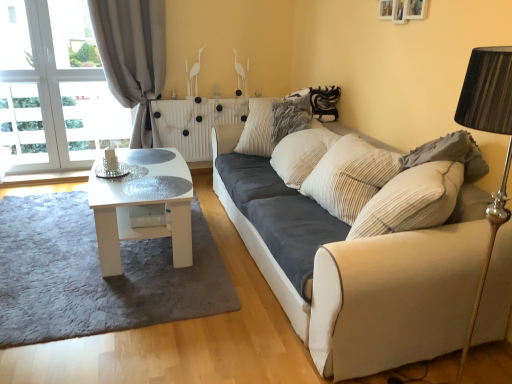
Image resolution: width=512 pixels, height=384 pixels. What do you see at coordinates (351, 260) in the screenshot?
I see `velvet beige couch at center` at bounding box center [351, 260].

Find the location of a particular element. striped fabric pillow at upper center, arranged as the second pillow when viewed from the front is located at coordinates [290, 116].

Describe the element at coordinates (157, 187) in the screenshot. I see `transparent glass table at center` at that location.

What do you see at coordinates (133, 57) in the screenshot?
I see `gray fabric curtain at left` at bounding box center [133, 57].

Locate an element on the screen. gray fabric curtain at left is located at coordinates (133, 57).

What do you see at coordinates (143, 206) in the screenshot? The image size is (512, 384). I see `white glossy coffee table at center` at bounding box center [143, 206].

What do you see at coordinates (96, 274) in the screenshot? I see `gray shaggy rug at lower left` at bounding box center [96, 274].

Describe the element at coordinates (450, 154) in the screenshot. I see `gray textured pillow at right, which is counted as the 1th pillow, starting from the front` at that location.

I want to click on velvet beige couch at center, so click(x=351, y=260).

Who is bigger, white glossy coffee table at center or gray shaggy rug at lower left?

white glossy coffee table at center is bigger.

Considering the sizes of objects white glossy coffee table at center and gray shaggy rug at lower left in the image provided, who is wider, white glossy coffee table at center or gray shaggy rug at lower left?

gray shaggy rug at lower left.

Does point (108, 235) come farther from viewer compared to point (15, 281)?

No, it is not.

Can you confirm if white glossy coffee table at center is taller than gray shaggy rug at lower left?

Yes, white glossy coffee table at center is taller than gray shaggy rug at lower left.

What's the angular difference between transparent glass table at center and white marble radiator at center's facing directions?

There is a 91.7-degree angle between the facing directions of transparent glass table at center and white marble radiator at center.

Is transparent glass table at center next to white marble radiator at center?

They are not placed beside each other.

Looking at this image, is transparent glass table at center wider or thinner than white marble radiator at center?

Clearly, transparent glass table at center has more width compared to white marble radiator at center.

From a real-world perspective, which is physically above, transparent glass table at center or white marble radiator at center?

transparent glass table at center is physically above.

Is striped fabric pillow at upper center, marked as the 1th pillow in a left-to-right arrangement, in contact with white marble radiator at center?

striped fabric pillow at upper center, marked as the 1th pillow in a left-to-right arrangement, and white marble radiator at center are clearly separated.

Which is behind, point (288, 107) or point (181, 113)?

The point (181, 113) is behind.

What are the coordinates of `radiator below the striped fabric pillow at upper center, marked as the 1th pillow in a left-to-right arrangement (from a real-world perspective)` in the screenshot? It's located at (195, 123).

From a real-world perspective, between striped fabric pillow at upper center, arranged as the second pillow when viewed from the front, and white marble radiator at center, who is vertically higher?

In real-world perspective, striped fabric pillow at upper center, arranged as the second pillow when viewed from the front, is above.

From a real-world perspective, is gray fabric curtain at left physically located above or below gray shaggy rug at lower left?

gray fabric curtain at left is situated higher than gray shaggy rug at lower left in the real world.

Measure the distance between gray fabric curtain at left and gray shaggy rug at lower left.

The distance of gray fabric curtain at left from gray shaggy rug at lower left is 5.02 feet.

Considering the positions of objects gray fabric curtain at left and gray shaggy rug at lower left in the image provided, who is more to the right, gray fabric curtain at left or gray shaggy rug at lower left?

gray fabric curtain at left.

How many degrees apart are the facing directions of gray fabric curtain at left and gray shaggy rug at lower left?

2.16 degrees.

Between point (472, 159) and point (105, 22), which one is positioned in front?

Point (472, 159)

Could you measure the distance between gray textured pillow at right, the second pillow viewed from the left, and gray fabric curtain at left?

8.62 feet.

From the image's perspective, who appears lower, gray textured pillow at right, the second pillow viewed from the left, or gray fabric curtain at left?

gray textured pillow at right, the second pillow viewed from the left, is shown below in the image.

Can you confirm if gray textured pillow at right, the second pillow when ordered from back to front, is bigger than gray fabric curtain at left?

No, gray textured pillow at right, the second pillow when ordered from back to front, is not bigger than gray fabric curtain at left.

Which is behind, white glossy coffee table at center or gray fabric curtain at left?

gray fabric curtain at left is further from the camera.

From the image's perspective, relative to gray fabric curtain at left, is white glossy coffee table at center above or below?

Clearly, from the image's perspective, white glossy coffee table at center is below gray fabric curtain at left.

Locate an element on the screen. curtain that appears behind the white glossy coffee table at center is located at coordinates (133, 57).

From a real-world perspective, which object rests below the other?

white glossy coffee table at center is physically lower.

Could you tell me if transparent glass table at center is facing velvet beige couch at center?

No, transparent glass table at center is not turned towards velvet beige couch at center.

Which object is wider, transparent glass table at center or velvet beige couch at center?

With larger width is velvet beige couch at center.

Which is more to the right, transparent glass table at center or velvet beige couch at center?

velvet beige couch at center.

What are the coordinates of `mat below the white glossy coffee table at center (from a real-world perspective)` in the screenshot? It's located at (96, 274).

Image resolution: width=512 pixels, height=384 pixels. I want to click on radiator on the right of the transparent glass table at center, so click(x=195, y=123).

Based on their spatial positions, is white glossy coffee table at center or gray textured pillow at right, the first pillow in the right-to-left sequence, closer to gray fabric curtain at left?

white glossy coffee table at center is closer to gray fabric curtain at left.

Looking at the image, which one is located closer to gray fabric curtain at left, velvet beige couch at center or gray shaggy rug at lower left?

gray shaggy rug at lower left.

Estimate the real-world distances between objects in this image. Which object is further from striped fabric pillow at upper center, which is the second pillow from right to left, gray fabric curtain at left or white glossy coffee table at center?

gray fabric curtain at left lies further to striped fabric pillow at upper center, which is the second pillow from right to left, than the other object.

Looking at the image, which one is located further to white marble radiator at center, white glossy coffee table at center or striped fabric pillow at upper center, arranged as the second pillow when viewed from the front?

white glossy coffee table at center lies further to white marble radiator at center than the other object.

From the image, which object appears to be nearer to gray shaggy rug at lower left, velvet beige couch at center or gray fabric curtain at left?

velvet beige couch at center is positioned closer to the anchor gray shaggy rug at lower left.

Looking at the image, which one is located further to striped fabric pillow at upper center, arranged as the second pillow when viewed from the front, gray shaggy rug at lower left or white marble radiator at center?

Based on the image, gray shaggy rug at lower left appears to be further to striped fabric pillow at upper center, arranged as the second pillow when viewed from the front.

Which object lies nearer to the anchor point gray fabric curtain at left, transparent glass table at center or velvet beige couch at center?

Among the two, transparent glass table at center is located nearer to gray fabric curtain at left.

Estimate the real-world distances between objects in this image. Which object is closer to striped fabric pillow at upper center, marked as the 1th pillow in a left-to-right arrangement, gray fabric curtain at left or gray shaggy rug at lower left?

gray fabric curtain at left lies closer to striped fabric pillow at upper center, marked as the 1th pillow in a left-to-right arrangement, than the other object.

This screenshot has width=512, height=384. Identify the location of curtain between gray shaggy rug at lower left and striped fabric pillow at upper center, marked as the 1th pillow in a left-to-right arrangement. (133, 57).

This screenshot has height=384, width=512. Find the location of `curtain between gray shaggy rug at lower left and gray textured pillow at right, the second pillow when ordered from back to front`. curtain between gray shaggy rug at lower left and gray textured pillow at right, the second pillow when ordered from back to front is located at coordinates (133, 57).

The height and width of the screenshot is (384, 512). I want to click on curtain between transparent glass table at center and white marble radiator at center along the z-axis, so click(x=133, y=57).

Find the location of a particular element. The width and height of the screenshot is (512, 384). glass table located between gray shaggy rug at lower left and gray textured pillow at right, the second pillow viewed from the left, in the left-right direction is located at coordinates (157, 187).